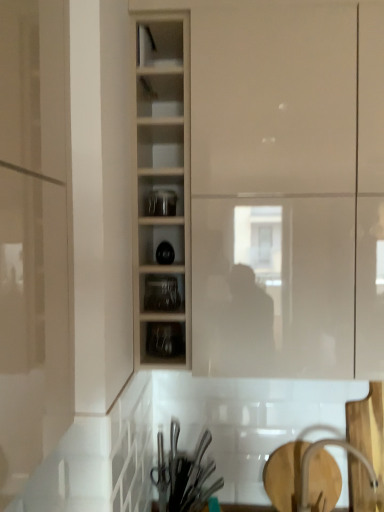
Question: Based on their sizes in the image, would you say clear glass jars at center, the 2th shelf viewed from the top, is bigger or smaller than metallic silver utensils at lower center, acting as the second tableware starting from the top?

Choices:
 (A) big
 (B) small

Answer: (B)

Question: From a real-world perspective, is clear glass jars at center, the 2th shelf viewed from the top, above or below metallic silver utensils at lower center, which is counted as the 2th tableware, starting from the front?

Choices:
 (A) below
 (B) above

Answer: (B)

Question: Which object is the farthest from the matte white cupboard at center?

Choices:
 (A) clear glass jars at center, which is the 1th shelf from bottom to top
 (B) wooden shelves at center
 (C) clear glass jars at center, the first shelf in the top-to-bottom sequence
 (D) white glossy faucet at lower right
 (E) metallic silver utensils at lower center, which is the 1th tableware from bottom to top

Answer: (D)

Question: Which object is positioned farthest from the metallic silver utensils at lower center, which is the 1th tableware from bottom to top?

Choices:
 (A) white glossy faucet at lower right
 (B) transparent glass jars at center, which ranks as the 1th tableware in top-to-bottom order
 (C) clear glass jars at center, which is the 1th shelf from bottom to top
 (D) matte white cupboard at center
 (E) wooden shelves at center

Answer: (B)